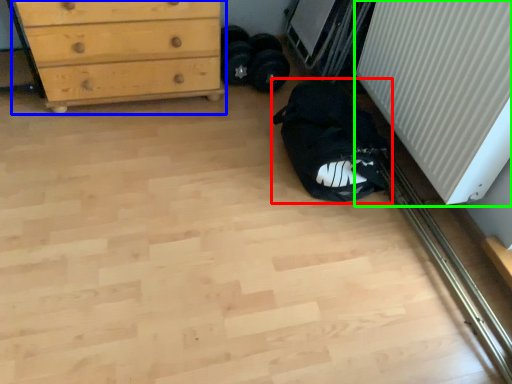
Question: Estimate the real-world distances between objects in this image. Which object is closer to sleeping bag (highlighted by a red box), chest of drawers (highlighted by a blue box) or radiator (highlighted by a green box)?

Choices:
 (A) chest of drawers
 (B) radiator

Answer: (B)